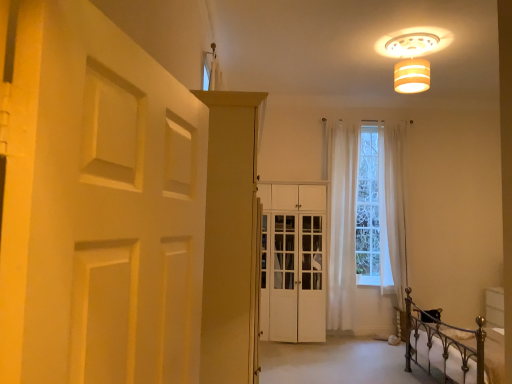
Where is `matte beige cylindrical lampshade at upper right`? The height and width of the screenshot is (384, 512). matte beige cylindrical lampshade at upper right is located at coordinates 412,56.

What do you see at coordinates (412, 56) in the screenshot? This screenshot has height=384, width=512. I see `matte beige cylindrical lampshade at upper right` at bounding box center [412, 56].

Measure the distance between matte white cabinet at center, the second door in the back-to-front sequence, and camera.

matte white cabinet at center, the second door in the back-to-front sequence, and camera are 1.80 meters apart from each other.

Where is `metallic wrought iron bed at lower right`? This screenshot has height=384, width=512. metallic wrought iron bed at lower right is located at coordinates pyautogui.click(x=443, y=347).

Is metallic wrought iron bed at lower right positioned with its back to white wood cabinet at center, the 2th door positioned from the left?

metallic wrought iron bed at lower right is not turned away from white wood cabinet at center, the 2th door positioned from the left.

Does point (471, 332) appear closer or farther from the camera than point (301, 270)?

Clearly, point (471, 332) is closer to the camera than point (301, 270).

Which of these two, metallic wrought iron bed at lower right or white wood cabinet at center, which is the 2th door from front to back, stands taller?

With more height is white wood cabinet at center, which is the 2th door from front to back.

Considering the relative sizes of metallic wrought iron bed at lower right and white wood cabinet at center, the 2th door positioned from the left, in the image provided, is metallic wrought iron bed at lower right wider than white wood cabinet at center, the 2th door positioned from the left,?

Correct, the width of metallic wrought iron bed at lower right exceeds that of white wood cabinet at center, the 2th door positioned from the left.

Could you tell me if white sheer curtain at center, the 1th curtain in the left-to-right sequence, is turned towards white wood cabinet at center, the 1th door when ordered from back to front?

No, white sheer curtain at center, the 1th curtain in the left-to-right sequence, is not facing towards white wood cabinet at center, the 1th door when ordered from back to front.

Considering the sizes of white sheer curtain at center, marked as the second curtain in a right-to-left arrangement, and white wood cabinet at center, the 1th door when ordered from back to front, in the image, is white sheer curtain at center, marked as the second curtain in a right-to-left arrangement, bigger or smaller than white wood cabinet at center, the 1th door when ordered from back to front,?

white sheer curtain at center, marked as the second curtain in a right-to-left arrangement, is smaller than white wood cabinet at center, the 1th door when ordered from back to front.

Between white sheer curtain at center, marked as the second curtain in a right-to-left arrangement, and white wood cabinet at center, the 2th door positioned from the left, which one is positioned in front?

Positioned in front is white wood cabinet at center, the 2th door positioned from the left.

From a real-world perspective, is white sheer curtain at center, the 1th curtain in the left-to-right sequence, physically above white wood cabinet at center, positioned as the first door in right-to-left order?

Yes, from a real-world perspective, white sheer curtain at center, the 1th curtain in the left-to-right sequence, is above white wood cabinet at center, positioned as the first door in right-to-left order.

There is a white wood cabinet at center, positioned as the first door in right-to-left order. What are the coordinates of `the 2nd curtain above it (from the image's perspective)` in the screenshot? It's located at (395, 207).

Looking at this image, is white sheer curtain at center, the 1th curtain when ordered from right to left, wider than white wood cabinet at center, the 1th door when ordered from back to front?

No.

Between white sheer curtain at center, the 1th curtain when ordered from right to left, and white wood cabinet at center, positioned as the first door in right-to-left order, which one has more height?

white sheer curtain at center, the 1th curtain when ordered from right to left.

Does white sheer curtain at center, arranged as the 2th curtain when viewed from the left, touch white wood cabinet at center, the 2th door positioned from the left?

white sheer curtain at center, arranged as the 2th curtain when viewed from the left, and white wood cabinet at center, the 2th door positioned from the left, are not in contact.

Between white sheer curtain at center, the 1th curtain when ordered from right to left, and white matte door at left, which one has smaller size?

Smaller between the two is white matte door at left.

Is white sheer curtain at center, arranged as the 2th curtain when viewed from the left, positioned with its back to white matte door at left?

That's not correct — white sheer curtain at center, arranged as the 2th curtain when viewed from the left, is not looking away from white matte door at left.

From the image's perspective, would you say white sheer curtain at center, the 1th curtain when ordered from right to left, is positioned over white matte door at left?

Incorrect, from the image's perspective, white sheer curtain at center, the 1th curtain when ordered from right to left, is lower than white matte door at left.

This screenshot has width=512, height=384. What are the coordinates of `the 2nd curtain counting from the right side of the white matte door at left` in the screenshot? It's located at (395, 207).

Considering the sizes of objects white sheer curtain at center, arranged as the 2th curtain when viewed from the left, and white sheer curtain at center, the 1th curtain in the left-to-right sequence, in the image provided, who is taller, white sheer curtain at center, arranged as the 2th curtain when viewed from the left, or white sheer curtain at center, the 1th curtain in the left-to-right sequence,?

white sheer curtain at center, the 1th curtain in the left-to-right sequence.

Where is `curtain in front of the white sheer curtain at center, the 1th curtain when ordered from right to left`? This screenshot has height=384, width=512. curtain in front of the white sheer curtain at center, the 1th curtain when ordered from right to left is located at coordinates (342, 227).

Is white sheer curtain at center, arranged as the 2th curtain when viewed from the left, behind white sheer curtain at center, the 1th curtain in the left-to-right sequence?

Yes, white sheer curtain at center, arranged as the 2th curtain when viewed from the left, is behind white sheer curtain at center, the 1th curtain in the left-to-right sequence.

Based on their positions, is white sheer curtain at center, the 1th curtain when ordered from right to left, located to the left or right of white sheer curtain at center, marked as the second curtain in a right-to-left arrangement?

Based on their positions, white sheer curtain at center, the 1th curtain when ordered from right to left, is located to the right of white sheer curtain at center, marked as the second curtain in a right-to-left arrangement.

Is white matte door at left wider than white wood cabinet at center, the 1th door when ordered from back to front?

No.

Can white wood cabinet at center, the 2th door positioned from the left, be found inside white matte door at left?

No, white matte door at left does not contain white wood cabinet at center, the 2th door positioned from the left.

Is white matte door at left facing towards white wood cabinet at center, the 1th door when ordered from back to front?

No, white matte door at left does not turn towards white wood cabinet at center, the 1th door when ordered from back to front.

This screenshot has width=512, height=384. In order to click on door that is the 2nd one when counting rightward from the white matte door at left in this screenshot , I will do `click(293, 262)`.

From the image's perspective, relative to white matte door at left, is white wood cabinet at center, positioned as the first door in right-to-left order, above or below?

white wood cabinet at center, positioned as the first door in right-to-left order, is below white matte door at left.

Would you say white wood cabinet at center, which is the 2th door from front to back, is outside white matte door at left?

white wood cabinet at center, which is the 2th door from front to back, lies outside white matte door at left's area.

Is white wood cabinet at center, positioned as the first door in right-to-left order, bigger than white matte door at left?

Yes, white wood cabinet at center, positioned as the first door in right-to-left order, is bigger than white matte door at left.

From a real-world perspective, between white wood cabinet at center, which is the 2th door from front to back, and white matte door at left, who is vertically higher?

white matte door at left, from a real-world perspective.

This screenshot has width=512, height=384. Find the location of `the 1st door above the metallic wrought iron bed at lower right (from a real-world perspective)`. the 1st door above the metallic wrought iron bed at lower right (from a real-world perspective) is located at coordinates (293, 262).

I want to click on the 2nd door positioned below the white sheer curtain at center, marked as the second curtain in a right-to-left arrangement (from the image's perspective), so click(293, 262).

From the image, which object appears to be farther from white wood cabinet at center, which is the 2th door from front to back, matte white cabinet at center, which is the 1th door from front to back, or white sheer curtain at center, the 1th curtain in the left-to-right sequence?

matte white cabinet at center, which is the 1th door from front to back, lies further to white wood cabinet at center, which is the 2th door from front to back, than the other object.

Based on their spatial positions, is matte white cabinet at center, the second door in the back-to-front sequence, or white wood cabinet at center, positioned as the first door in right-to-left order, further from white matte door at left?

The object further to white matte door at left is white wood cabinet at center, positioned as the first door in right-to-left order.

Based on their spatial positions, is white sheer curtain at center, the 1th curtain when ordered from right to left, or matte beige cylindrical lampshade at upper right closer to white matte door at left?

Among the two, matte beige cylindrical lampshade at upper right is located nearer to white matte door at left.

From the image, which object appears to be farther from white matte door at left, matte beige cylindrical lampshade at upper right or matte white cabinet at center, the first door when ordered from left to right?

matte beige cylindrical lampshade at upper right.

Which object lies further to the anchor point white sheer curtain at center, marked as the second curtain in a right-to-left arrangement, white wood cabinet at center, the 2th door positioned from the left, or metallic wrought iron bed at lower right?

Based on the image, metallic wrought iron bed at lower right appears to be further to white sheer curtain at center, marked as the second curtain in a right-to-left arrangement.

Which object lies nearer to the anchor point white sheer curtain at center, the 1th curtain in the left-to-right sequence, matte white cabinet at center, the second door in the back-to-front sequence, or white sheer curtain at center, the 1th curtain when ordered from right to left?

white sheer curtain at center, the 1th curtain when ordered from right to left, is positioned closer to the anchor white sheer curtain at center, the 1th curtain in the left-to-right sequence.

Considering their positions, is metallic wrought iron bed at lower right positioned closer to white sheer curtain at center, marked as the second curtain in a right-to-left arrangement, than matte white cabinet at center, which is the 1th door from front to back?

Among the two, metallic wrought iron bed at lower right is located nearer to white sheer curtain at center, marked as the second curtain in a right-to-left arrangement.

Considering their positions, is metallic wrought iron bed at lower right positioned further to white wood cabinet at center, the 1th door when ordered from back to front, than white sheer curtain at center, the 1th curtain in the left-to-right sequence?

Based on the image, metallic wrought iron bed at lower right appears to be further to white wood cabinet at center, the 1th door when ordered from back to front.

This screenshot has width=512, height=384. In order to click on bed between white matte door at left and matte beige cylindrical lampshade at upper right in the front-back direction in this screenshot , I will do `click(443, 347)`.

You are a GUI agent. You are given a task and a screenshot of the screen. Output one action in this format:
    pyautogui.click(x=<x>, y=<y>)
    Task: Click on the bed between white matte door at left and white sheer curtain at center, arranged as the 2th curtain when viewed from the left, in the front-back direction
    The image size is (512, 384).
    Given the screenshot: What is the action you would take?
    pyautogui.click(x=443, y=347)

The width and height of the screenshot is (512, 384). I want to click on bed between matte white cabinet at center, the second door in the back-to-front sequence, and white sheer curtain at center, marked as the second curtain in a right-to-left arrangement, along the z-axis, so click(443, 347).

Locate an element on the screen. The width and height of the screenshot is (512, 384). curtain located between white matte door at left and white sheer curtain at center, arranged as the 2th curtain when viewed from the left, in the depth direction is located at coordinates (342, 227).